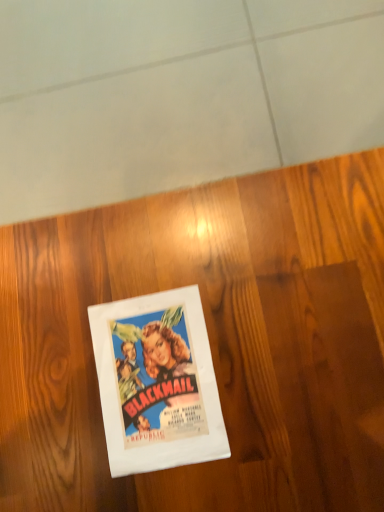
Where is `vacant area situated below white paper at center (from a real-world perspective)`? The height and width of the screenshot is (512, 384). vacant area situated below white paper at center (from a real-world perspective) is located at coordinates (158, 375).